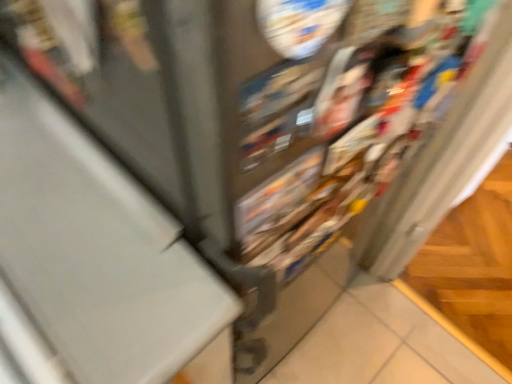
At what (x,y) coordinates should I click in order to perform the action: click on wooden at right. Please return your answer as a coordinate pair (x, y). Looking at the image, I should click on (472, 270).

Image resolution: width=512 pixels, height=384 pixels. What do you see at coordinates (472, 270) in the screenshot?
I see `wooden at right` at bounding box center [472, 270].

Find the location of `wooden at right`. wooden at right is located at coordinates (472, 270).